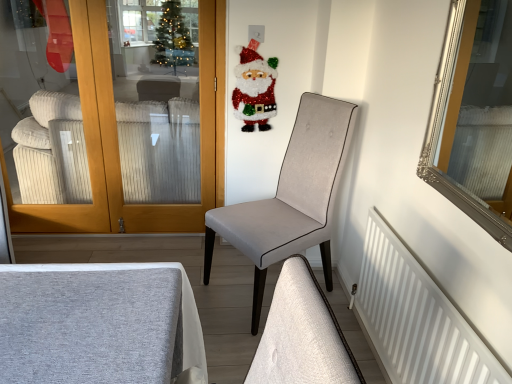
In order to face white matte radiator at lower right, should I rotate leftwards or rightwards?

Rotate your view right by about 19.258°.

Where is `white ribbed fabric couch at left`? The width and height of the screenshot is (512, 384). white ribbed fabric couch at left is located at coordinates (160, 150).

Measure the distance between silver/glass mirror at upper right and camera.

A distance of 9.73 feet exists between silver/glass mirror at upper right and camera.

Identify the location of glittery santa claus at upper center. (254, 88).

Is glittery santa claus at upper center shorter than silver/glass mirror at upper right?

Yes.

Can you tell me how much glittery santa claus at upper center and silver/glass mirror at upper right differ in facing direction?

They differ by 91.3 degrees in their facing directions.

Is glittery santa claus at upper center positioned far away from silver/glass mirror at upper right?

Yes.

From a real-world perspective, is glittery santa claus at upper center above or below silver/glass mirror at upper right?

In terms of real-world spatial position, glittery santa claus at upper center is below silver/glass mirror at upper right.

Does silver/glass mirror at upper right have a larger size compared to white matte radiator at lower right?

No, silver/glass mirror at upper right is not bigger than white matte radiator at lower right.

Considering the points (463, 211) and (434, 344), which point is in front, point (463, 211) or point (434, 344)?

Positioned in front is point (463, 211).

You are a GUI agent. You are given a task and a screenshot of the screen. Output one action in this format:
    pyautogui.click(x=<x>, y=<y>)
    Task: Click on the mirror in front of the white matte radiator at lower right
    The width and height of the screenshot is (512, 384).
    Given the screenshot: What is the action you would take?
    pyautogui.click(x=474, y=117)

Identify the location of studio couch that is under the silver/glass mirror at upper right (from a real-world perspective). The height and width of the screenshot is (384, 512). (160, 150).

Considering the positions of point (472, 53) and point (57, 165), is point (472, 53) closer or farther from the camera than point (57, 165)?

Point (472, 53) is farther from the camera than point (57, 165).

Considering the sizes of silver/glass mirror at upper right and white ribbed fabric couch at left in the image, is silver/glass mirror at upper right wider or thinner than white ribbed fabric couch at left?

Considering their sizes, silver/glass mirror at upper right looks slimmer than white ribbed fabric couch at left.

Considering the sizes of objects silver/glass mirror at upper right and white ribbed fabric couch at left in the image provided, who is shorter, silver/glass mirror at upper right or white ribbed fabric couch at left?

Standing shorter between the two is silver/glass mirror at upper right.

Are glittery santa claus at upper center and white ribbed fabric couch at left far apart?

glittery santa claus at upper center is near white ribbed fabric couch at left, not far away.

Find the location of a particular element. This screenshot has width=512, height=384. studio couch lying on the left of glittery santa claus at upper center is located at coordinates (160, 150).

Consider the image. From the image's perspective, is glittery santa claus at upper center under white ribbed fabric couch at left?

No, from the image's perspective, glittery santa claus at upper center is not below white ribbed fabric couch at left.

Looking at this image, are white matte radiator at lower right and silver/glass mirror at upper right beside each other?

No.

Find the location of a particular element. This screenshot has height=384, width=512. radiator below the silver/glass mirror at upper right (from the image's perspective) is located at coordinates (417, 317).

Which is behind, silver/glass mirror at upper right or light gray fabric chair at center?

Positioned behind is light gray fabric chair at center.

Who is shorter, silver/glass mirror at upper right or light gray fabric chair at center?

silver/glass mirror at upper right.

From the image's perspective, between silver/glass mirror at upper right and light gray fabric chair at center, which one is located above?

silver/glass mirror at upper right is shown above in the image.

Which is less distant, (435, 148) or (313, 148)?

The point (435, 148) is closer.

Does white ribbed fabric couch at left have a greater height compared to light gray fabric chair at center?

In fact, white ribbed fabric couch at left may be shorter than light gray fabric chair at center.

From the image's perspective, which object appears higher, white ribbed fabric couch at left or light gray fabric chair at center?

white ribbed fabric couch at left, from the image's perspective.

From a real-world perspective, which object stands above the other?

light gray fabric chair at center.

Image resolution: width=512 pixels, height=384 pixels. I want to click on santa claus that is behind the silver/glass mirror at upper right, so click(254, 88).

At what (x,y) coordinates should I click in order to perform the action: click on mirror on the right of white matte radiator at lower right. Please return your answer as a coordinate pair (x, y). The image size is (512, 384). Looking at the image, I should click on coord(474,117).

Estimate the real-world distances between objects in this image. Which object is closer to white ribbed fabric couch at left, glittery santa claus at upper center or white matte radiator at lower right?

glittery santa claus at upper center is closer to white ribbed fabric couch at left.

Estimate the real-world distances between objects in this image. Which object is closer to glittery santa claus at upper center, silver/glass mirror at upper right or light gray fabric chair at center?

Among the two, light gray fabric chair at center is located nearer to glittery santa claus at upper center.

Which object lies nearer to the anchor point white matte radiator at lower right, light gray fabric chair at center or glittery santa claus at upper center?

light gray fabric chair at center is positioned closer to the anchor white matte radiator at lower right.

Based on the photo, looking at the image, which one is located further to white matte radiator at lower right, white ribbed fabric couch at left or silver/glass mirror at upper right?

white ribbed fabric couch at left is further to white matte radiator at lower right.

Considering their positions, is white ribbed fabric couch at left positioned further to glittery santa claus at upper center than silver/glass mirror at upper right?

silver/glass mirror at upper right.

Which object lies further to the anchor point light gray fabric chair at center, white ribbed fabric couch at left or glittery santa claus at upper center?

The object further to light gray fabric chair at center is white ribbed fabric couch at left.

Looking at the image, which one is located further to light gray fabric chair at center, white ribbed fabric couch at left or white matte radiator at lower right?

Among the two, white ribbed fabric couch at left is located further to light gray fabric chair at center.

Consider the image. Looking at the image, which one is located further to light gray fabric chair at center, glittery santa claus at upper center or white ribbed fabric couch at left?

white ribbed fabric couch at left is positioned further to the anchor light gray fabric chair at center.

At what (x,y) coordinates should I click in order to perform the action: click on santa claus positioned between silver/glass mirror at upper right and white ribbed fabric couch at left from near to far. Please return your answer as a coordinate pair (x, y). The image size is (512, 384). Looking at the image, I should click on (254, 88).

Find the location of `santa claus positioned between white matte radiator at lower right and white ribbed fabric couch at left from near to far`. santa claus positioned between white matte radiator at lower right and white ribbed fabric couch at left from near to far is located at coordinates point(254,88).

Identify the location of radiator located between silver/glass mirror at upper right and glittery santa claus at upper center in the depth direction. The height and width of the screenshot is (384, 512). (417, 317).

This screenshot has height=384, width=512. Find the location of `chair between silver/glass mirror at upper right and white ribbed fabric couch at left in the front-back direction`. chair between silver/glass mirror at upper right and white ribbed fabric couch at left in the front-back direction is located at coordinates (291, 197).